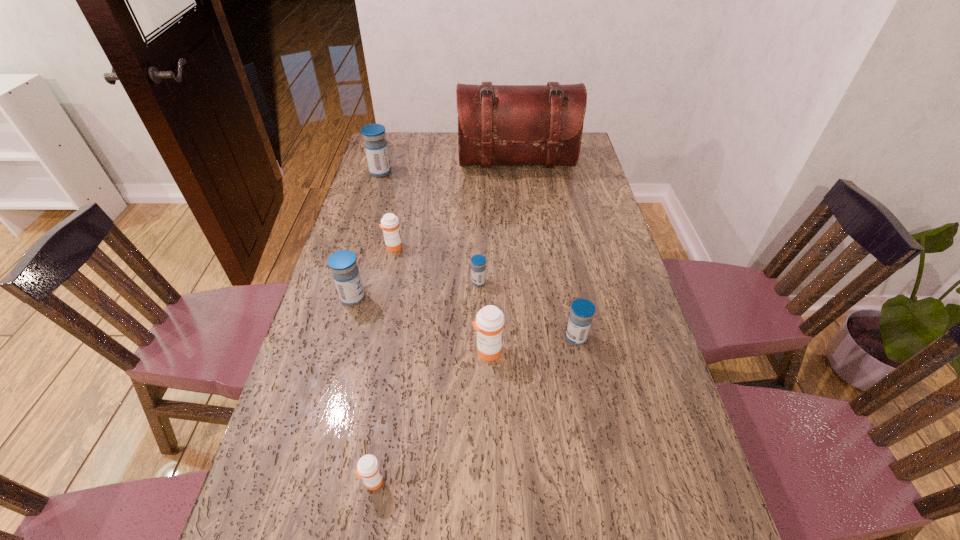
Where is `the rightmost blue medicine`? the rightmost blue medicine is located at coordinates pyautogui.click(x=582, y=310).

The width and height of the screenshot is (960, 540). Identify the location of the third biggest blue medicine. (582, 310).

I want to click on the third nearest blue medicine, so click(x=478, y=268).

You are a GUI agent. You are given a task and a screenshot of the screen. Output one action in this format:
    pyautogui.click(x=<x>, y=<y>)
    Task: Click on the fourth farthest object
    Image resolution: width=960 pixels, height=540 pixels.
    Given the screenshot: What is the action you would take?
    pyautogui.click(x=478, y=268)

The height and width of the screenshot is (540, 960). I want to click on the nearest object, so click(x=368, y=468).

Locate an element on the screen. the second orange medicine from left to right is located at coordinates pyautogui.click(x=368, y=468).

Where is `free space located 0.340m on the front-facing side of the satchel`? free space located 0.340m on the front-facing side of the satchel is located at coordinates (524, 237).

You are a GUI agent. You are given a task and a screenshot of the screen. Output one action in this format:
    pyautogui.click(x=<x>, y=<y>)
    Task: Click on the free space located on the right of the farthest blue medicine
    The width and height of the screenshot is (960, 540).
    Given the screenshot: What is the action you would take?
    pyautogui.click(x=415, y=172)

Where is `vacant space located 0.260m on the right of the second farthest orange medicine`? vacant space located 0.260m on the right of the second farthest orange medicine is located at coordinates (604, 350).

At what (x,y) coordinates should I click in order to perform the action: click on vacant area located 0.380m on the right of the second biggest blue medicine. Please return your answer as a coordinate pair (x, y). The width and height of the screenshot is (960, 540). Looking at the image, I should click on (499, 298).